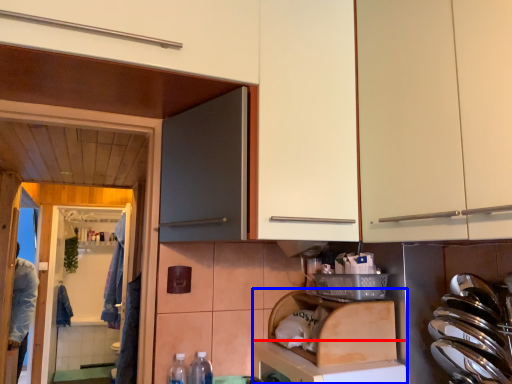
Question: Among these objects, which one is farthest to the camera, dish washer (highlighted by a red box) or dish washer (highlighted by a blue box)?

Choices:
 (A) dish washer
 (B) dish washer

Answer: (B)